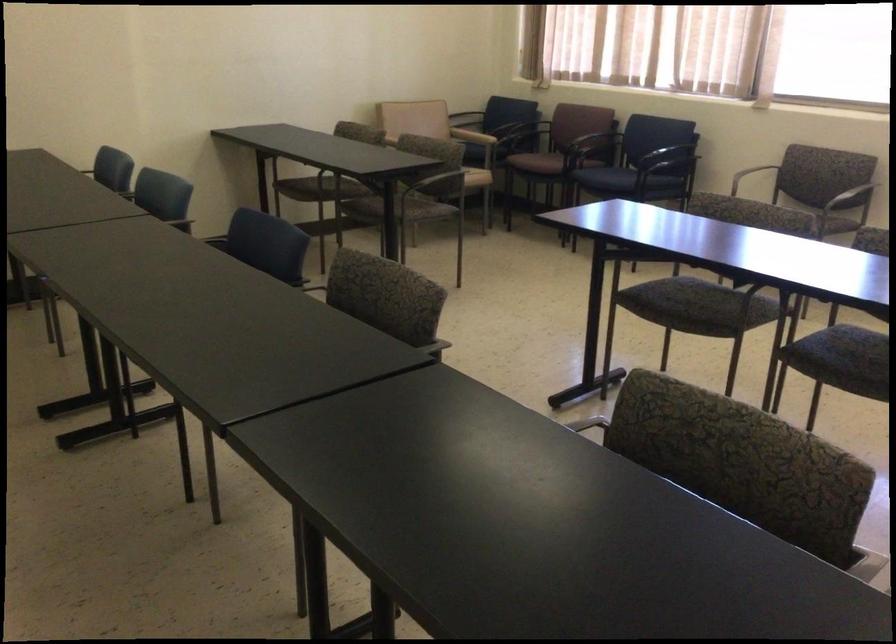
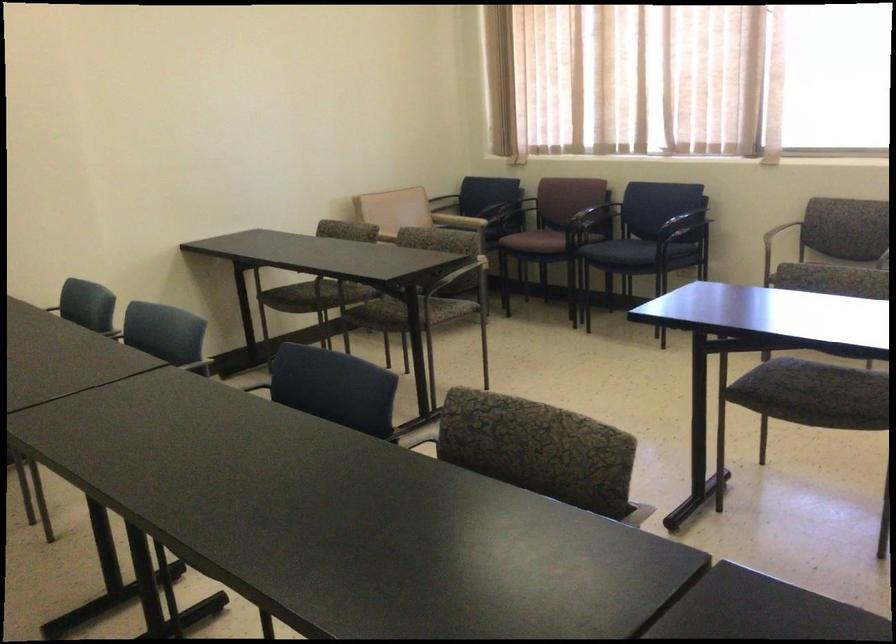
The point at (x=401, y=113) is marked in the first image. Where is the corresponding point in the second image?

(381, 205)